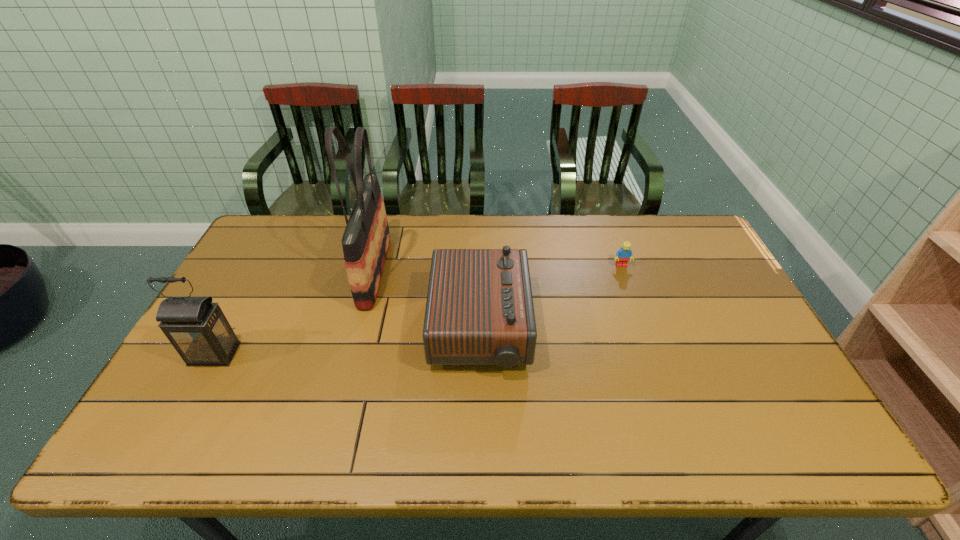
Where is `shopping bag`? Image resolution: width=960 pixels, height=540 pixels. shopping bag is located at coordinates (366, 239).

Identify the location of the tallest object. (366, 239).

Identify the location of the second tallest object. The image size is (960, 540). (197, 328).

Image resolution: width=960 pixels, height=540 pixels. I want to click on lantern, so [x=197, y=328].

Where is `radio receiver`? radio receiver is located at coordinates (479, 311).

Find the location of a particular element. The height and width of the screenshot is (540, 960). the second shortest object is located at coordinates (479, 311).

Where is `Lego`? The image size is (960, 540). Lego is located at coordinates (623, 255).

Locate an element on the screen. The image size is (960, 540). the rightmost object is located at coordinates (623, 255).

Identify the location of free space located 0.330m on the front-facing side of the second object from left to right. tap(492, 271).

Where is `free space located on the front-facing side of the lantern`? The image size is (960, 540). free space located on the front-facing side of the lantern is located at coordinates (165, 446).